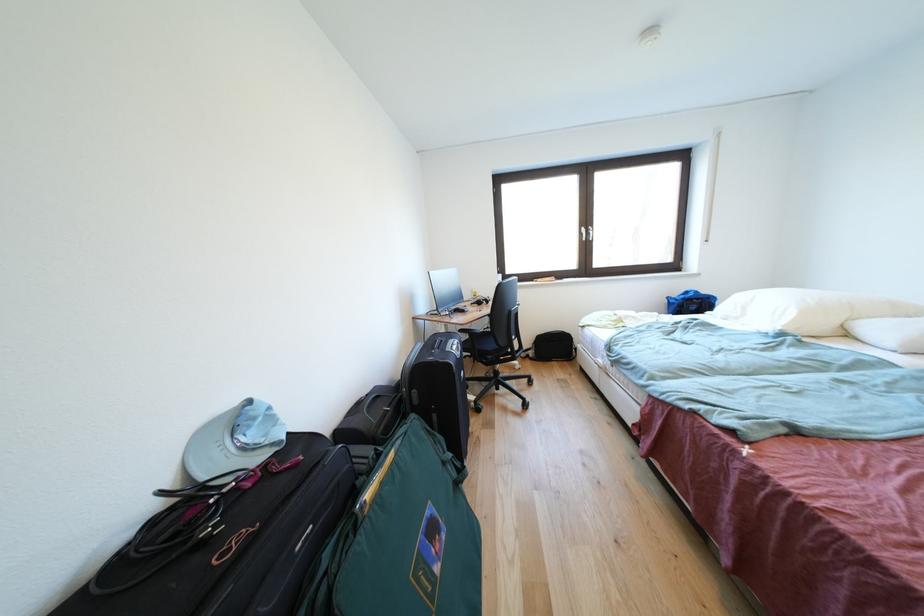
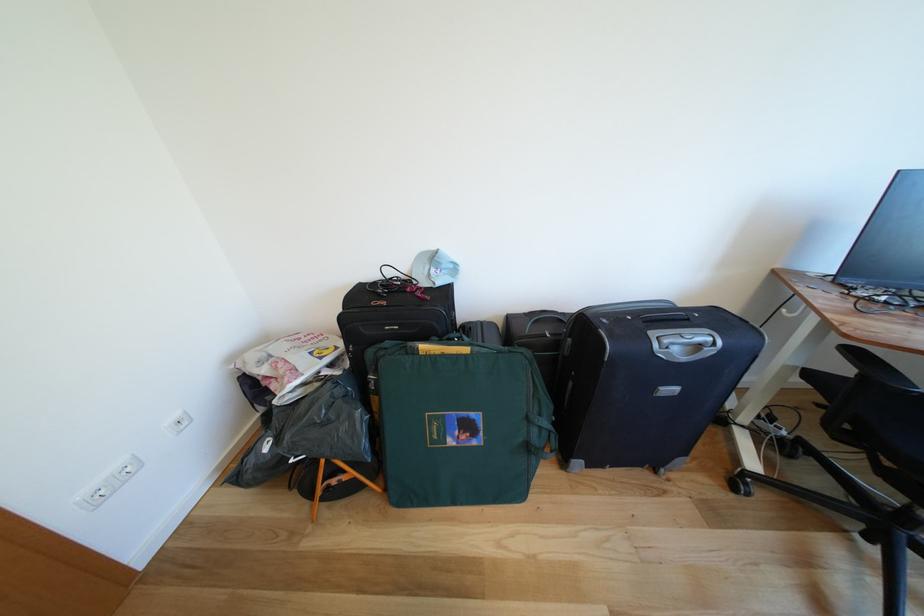
Question: I am providing you with two images of the same scene from different viewpoints. Which of the following objects are not visible in image2?

Choices:
 (A) black suitcase handle
 (B) light blue cap
 (C) green bag handle
 (D) none of these

Answer: (D)